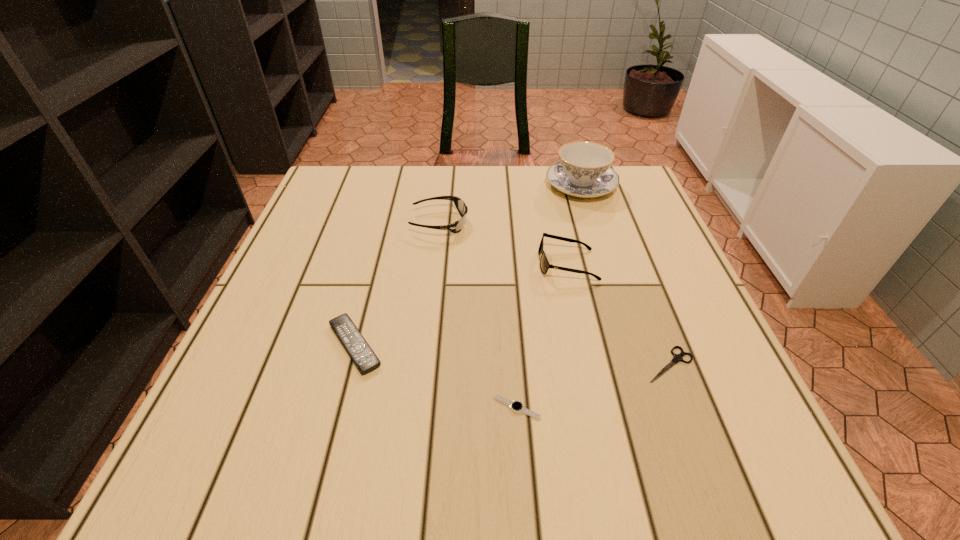
At what (x,y) coordinates should I click in order to perform the action: click on free point between the nearer sunglasses and the nearest object. Please return your answer as a coordinate pair (x, y). This screenshot has width=960, height=540. Looking at the image, I should click on (542, 336).

Identify which object is located as the fourth nearest to the shears. Please provide its 2D coordinates. Your answer should be formatted as a tuple, i.e. [(x, y)], where the tuple contains the x and y coordinates of a point satisfying the conditions above.

[(584, 170)]

Identify which object is the fifth closest to the shears. Please provide its 2D coordinates. Your answer should be formatted as a tuple, i.e. [(x, y)], where the tuple contains the x and y coordinates of a point satisfying the conditions above.

[(363, 356)]

This screenshot has width=960, height=540. In order to click on vacant region that satisfies the following two spatial constraints: 1. on the front-facing side of the shears; 2. on the left side of the fourth nearest object in this screenshot , I will do `click(589, 364)`.

Locate an element on the screen. The height and width of the screenshot is (540, 960). vacant position in the image that satisfies the following two spatial constraints: 1. on the front-facing side of the third farthest object; 2. on the back side of the shears is located at coordinates (589, 364).

Identify the location of blank space that satisfies the following two spatial constraints: 1. on the front-facing side of the nearer sunglasses; 2. on the left side of the shears. (589, 364).

Find the location of a particular element. The height and width of the screenshot is (540, 960). vacant space that satisfies the following two spatial constraints: 1. on the lenses of the left sunglasses; 2. on the front side of the leftmost object is located at coordinates (425, 345).

Find the location of a particular element. Image resolution: width=960 pixels, height=540 pixels. free region that satisfies the following two spatial constraints: 1. on the front-facing side of the nearer sunglasses; 2. on the front side of the leftmost object is located at coordinates (585, 345).